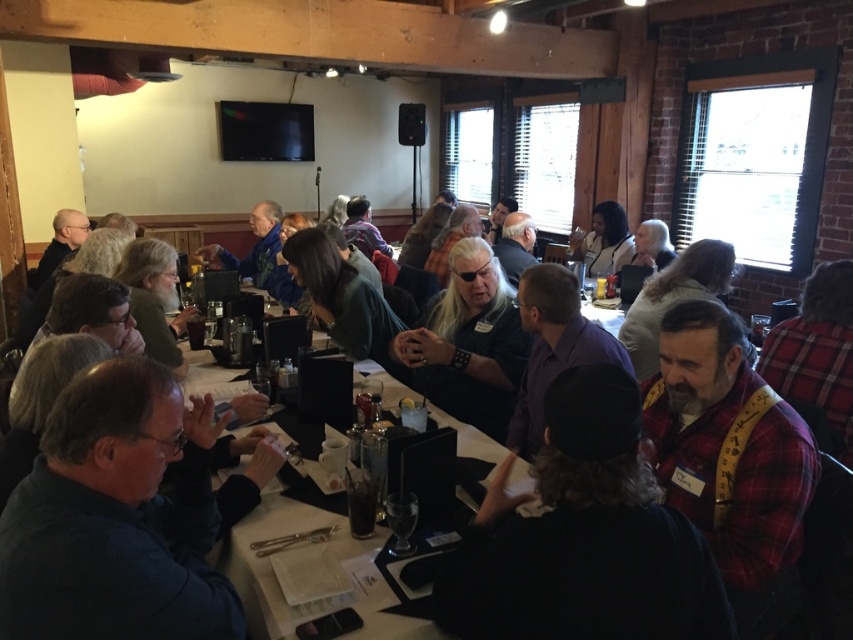
Can you confirm if plaid flannel shirt at right is bigger than matte black jacket at center?

Incorrect, plaid flannel shirt at right is not larger than matte black jacket at center.

This screenshot has width=853, height=640. What do you see at coordinates (817, 356) in the screenshot? I see `plaid flannel shirt at right` at bounding box center [817, 356].

Identify the location of plaid flannel shirt at right. [817, 356].

Is dark blue shirt at lower left thinner than purple shirt at center?

Indeed, dark blue shirt at lower left has a lesser width compared to purple shirt at center.

Which of these two, dark blue shirt at lower left or purple shirt at center, stands taller?

purple shirt at center is taller.

Is point (134, 499) less distant than point (538, 384)?

Yes, it is in front of point (538, 384).

The height and width of the screenshot is (640, 853). I want to click on dark blue shirt at lower left, so click(x=117, y=516).

Does dark blue shirt at lower left have a larger size compared to matte black jacket at center?

Incorrect, dark blue shirt at lower left is not larger than matte black jacket at center.

Does dark blue shirt at lower left appear on the left side of matte black jacket at center?

Correct, you'll find dark blue shirt at lower left to the left of matte black jacket at center.

Which is in front, point (241, 634) or point (613, 240)?

Positioned in front is point (241, 634).

Where is `dark blue shirt at lower left`? The image size is (853, 640). dark blue shirt at lower left is located at coordinates (117, 516).